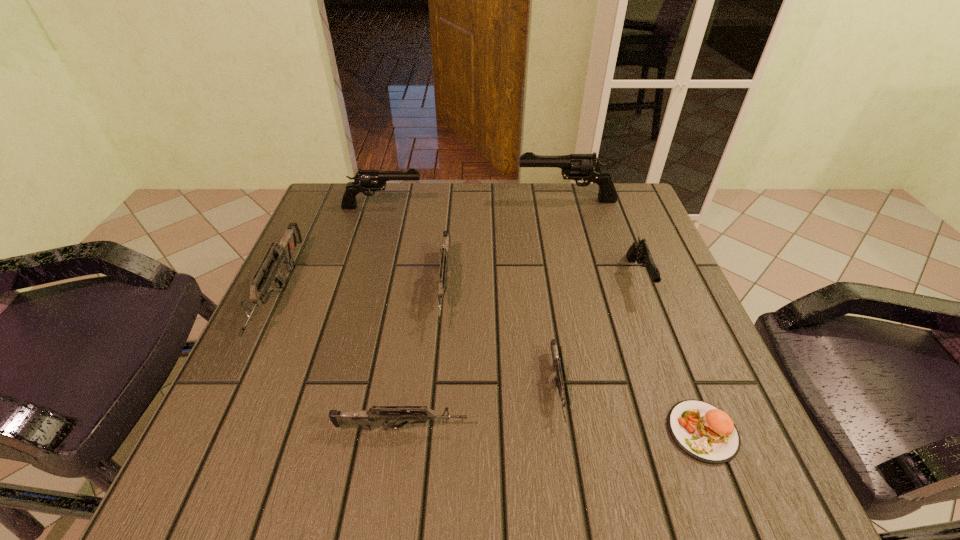
I want to click on the seventh tallest object, so click(559, 383).

Identify the location of patty. (703, 431).

Find the location of a particular element. Image resolution: width=960 pixels, height=540 pixels. vacant space situated at the end of the barrel of the tallest gun is located at coordinates (477, 200).

Identify the location of free space located at the end of the barrel of the tallest gun. click(390, 200).

The height and width of the screenshot is (540, 960). Identify the location of free space located at the end of the barrel of the tallest gun. (375, 200).

I want to click on vacant space situated 0.090m at the end of the barrel of the leftmost black gun, so click(x=456, y=207).

Locate an element on the screen. This screenshot has width=960, height=540. vacant point located 0.120m aimed along the barrel of the leftmost grey gun is located at coordinates (224, 413).

Identify the location of free spot located 0.200m at the end of the barrel of the smallest black gun. (680, 387).

The width and height of the screenshot is (960, 540). I want to click on vacant space situated aimed along the barrel of the third smallest grey gun, so click(x=435, y=408).

In order to click on free spot located aimed along the barrel of the sixth tallest object in this screenshot , I will do `click(633, 428)`.